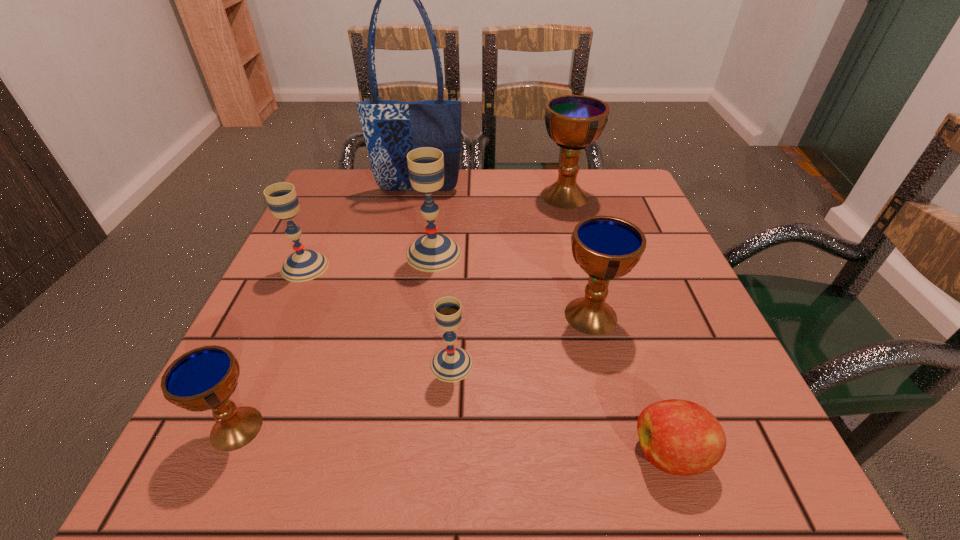
The width and height of the screenshot is (960, 540). I want to click on chalice that is the closest one to the smallest gray chalice, so click(605, 247).

Identify which blue chalice is the second closest to the nearest gray chalice. Please provide its 2D coordinates. Your answer should be formatted as a tuple, i.e. [(x, y)], where the tuple contains the x and y coordinates of a point satisfying the conditions above.

[(204, 378)]

You are a GUI agent. You are given a task and a screenshot of the screen. Output one action in this format:
    pyautogui.click(x=<x>, y=<y>)
    Task: Click on the blue chalice object that ranks as the third closest to the biggest gray chalice
    
    Given the screenshot: What is the action you would take?
    pyautogui.click(x=204, y=378)

Find the location of a particular element. Image resolution: width=960 pixels, height=540 pixels. the second closest gray chalice to the biggest gray chalice is located at coordinates (450, 364).

Select which gray chalice is the closest to the third nearest object. Please provide its 2D coordinates. Your answer should be formatted as a tuple, i.e. [(x, y)], where the tuple contains the x and y coordinates of a point satisfying the conditions above.

[(432, 252)]

The height and width of the screenshot is (540, 960). Identify the location of free space that satisfies the following two spatial constraints: 1. on the front side of the red apple; 2. on the right side of the second biggest blue chalice. (626, 454).

At what (x,y) coordinates should I click in order to perform the action: click on vacant region that satisfies the following two spatial constraints: 1. on the back side of the farthest blue chalice; 2. on the right side of the sixth farthest object. Please return your answer as a coordinate pair (x, y). Looking at the image, I should click on (462, 196).